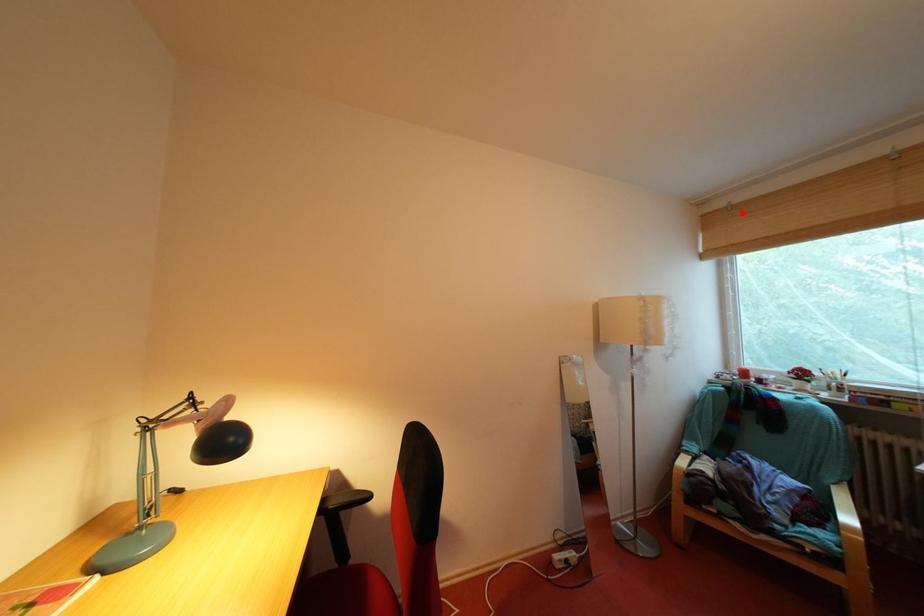
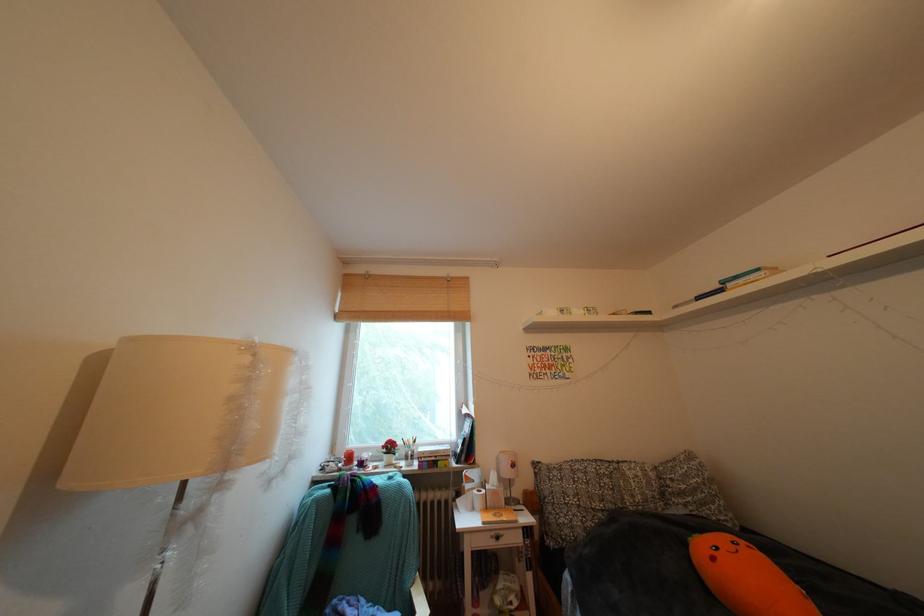
The point at the highlighted location is marked in the first image. Where is the corresponding point in the second image?

(379, 282)